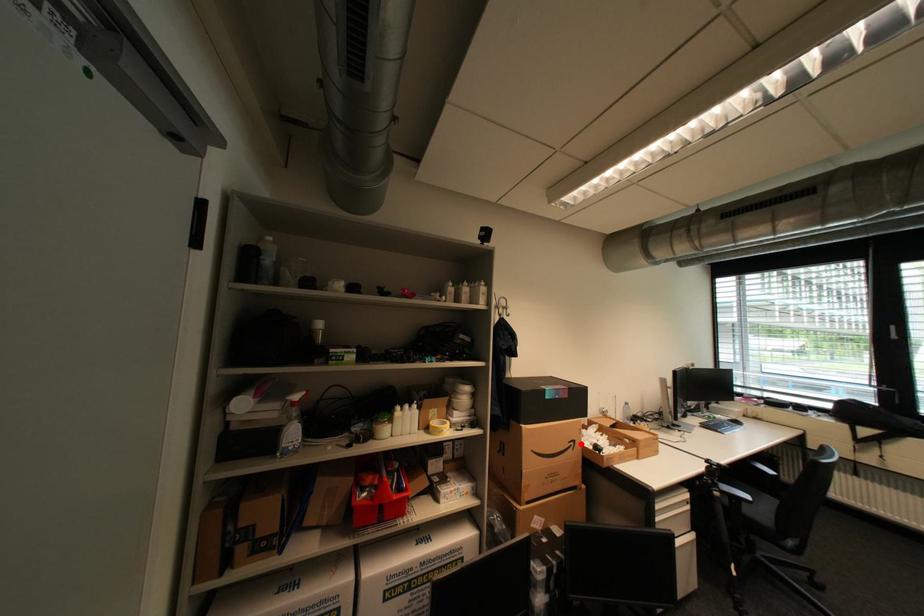
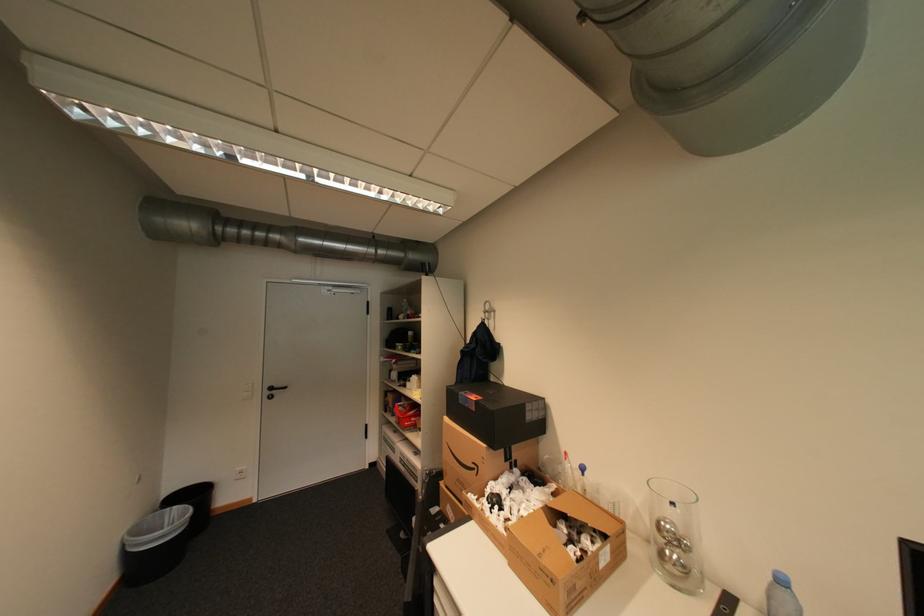
Question: I am providing you with two images of the same scene from different viewpoints. A red point is shown in image1. For the corresponding object point in image2, is it positioned nearer or farther from the camera?

Choices:
 (A) Nearer
 (B) Farther

Answer: (B)